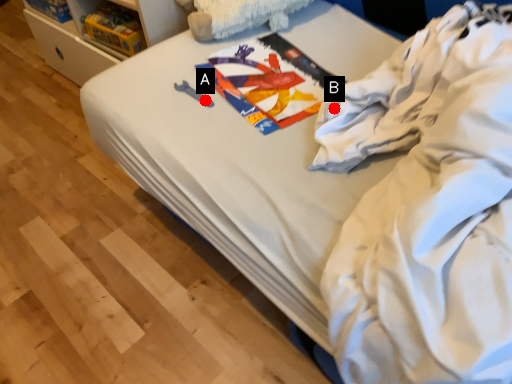
Question: Two points are circled on the image, labeled by A and B beside each circle. Which of the following is the closest to the observer?

Choices:
 (A) A is closer
 (B) B is closer

Answer: (B)